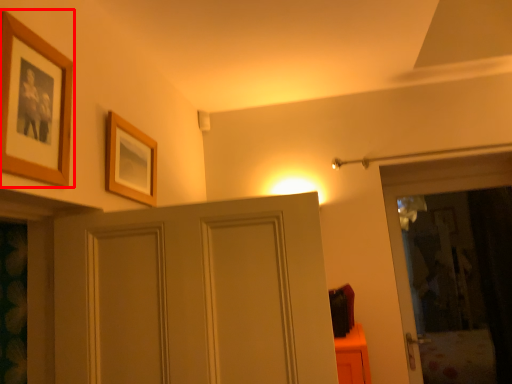
Question: From the image's perspective, where is picture frame (annotated by the red box) located relative to picture frame?

Choices:
 (A) below
 (B) above

Answer: (B)